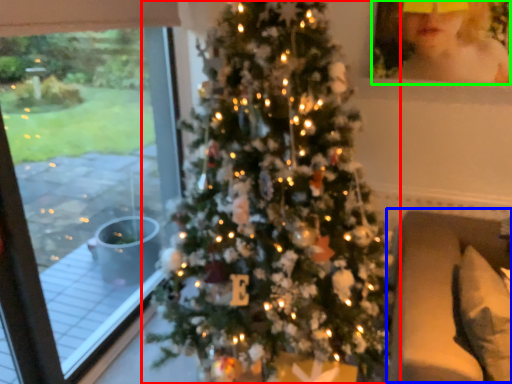
Question: Which is nearer to the christmas tree (highlighted by a red box)? couch (highlighted by a blue box) or toddler (highlighted by a green box).

Choices:
 (A) couch
 (B) toddler

Answer: (A)